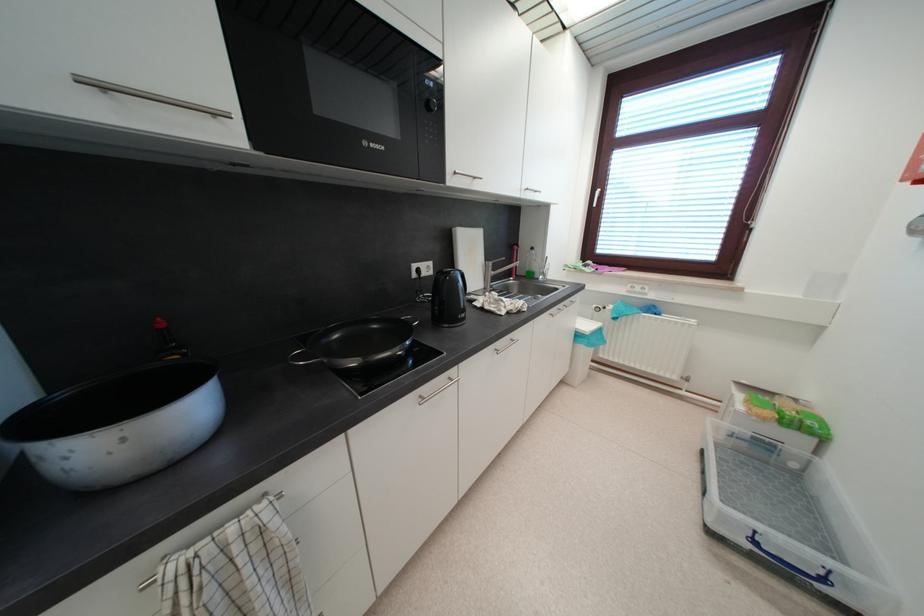
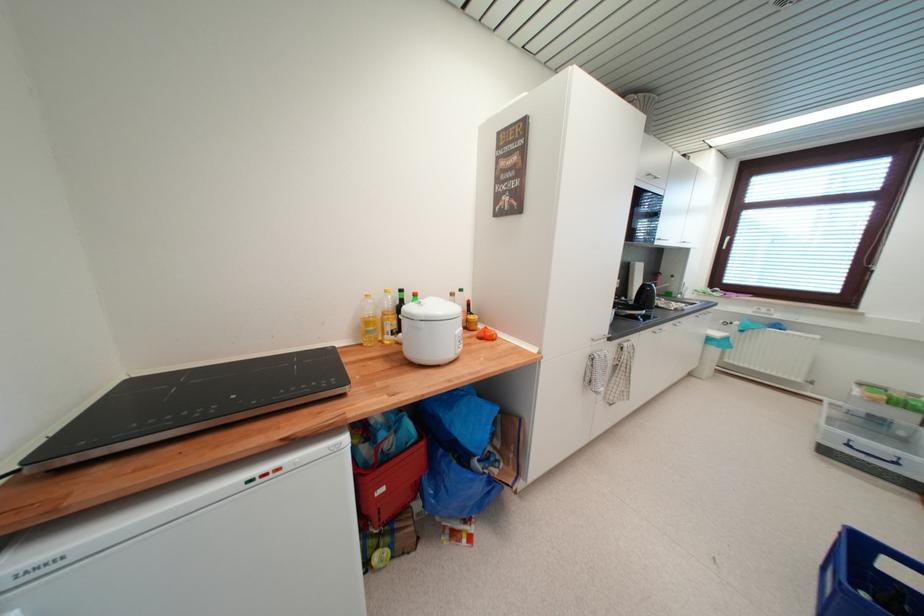
Where in the second image is the point corresponding to point 760,545 from the first image?

(854, 448)